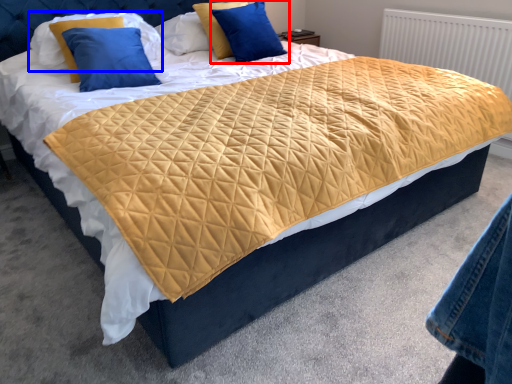
Question: Which object is further to the camera taking this photo, pillow (highlighted by a red box) or pillow (highlighted by a blue box)?

Choices:
 (A) pillow
 (B) pillow

Answer: (A)